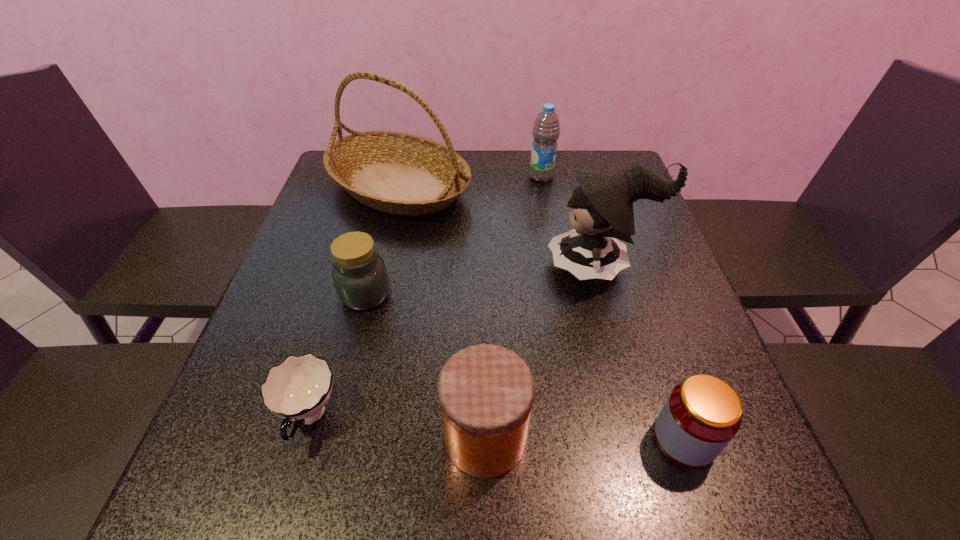
Choose which object is the nearest neighbor to the leftmost jar. Please provide its 2D coordinates. Your answer should be formatted as a tuple, i.e. [(x, y)], where the tuple contains the x and y coordinates of a point satisfying the conditions above.

[(298, 389)]

Find the location of a particular element. object that can be found as the third closest to the doll is located at coordinates (486, 391).

Point out which jar is positioned as the third nearest to the cup. Please provide its 2D coordinates. Your answer should be formatted as a tuple, i.e. [(x, y)], where the tuple contains the x and y coordinates of a point satisfying the conditions above.

[(702, 414)]

The width and height of the screenshot is (960, 540). I want to click on jar identified as the closest to the basket, so [360, 276].

Locate an element on the screen. vacant position in the image that satisfies the following two spatial constraints: 1. on the back side of the rightmost jar; 2. at the face of the doll is located at coordinates (626, 266).

Locate an element on the screen. The height and width of the screenshot is (540, 960). vacant space that satisfies the following two spatial constraints: 1. on the side of the cup with the handle; 2. on the left side of the second jar from left to right is located at coordinates (303, 437).

I want to click on vacant space that satisfies the following two spatial constraints: 1. on the front side of the rightmost jar; 2. on the right side of the water bottle, so click(588, 439).

The height and width of the screenshot is (540, 960). I want to click on vacant region that satisfies the following two spatial constraints: 1. at the face of the rightmost jar; 2. on the right side of the doll, so click(650, 439).

Identify the location of vacant space that satisfies the following two spatial constraints: 1. on the back side of the rightmost jar; 2. at the face of the doll. [x=626, y=266].